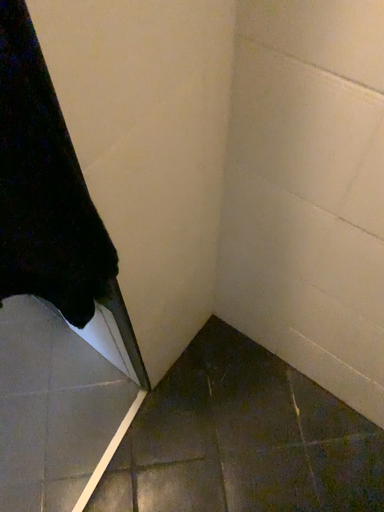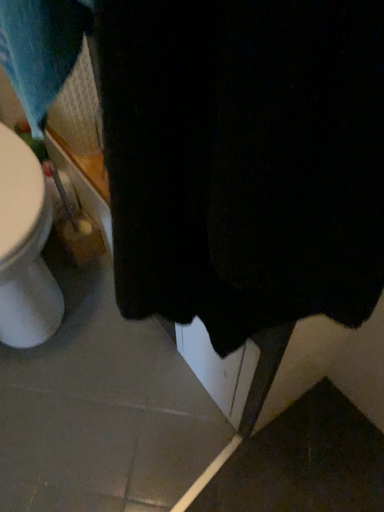
Question: Which way did the camera rotate in the video?

Choices:
 (A) rotated upward
 (B) rotated downward

Answer: (A)